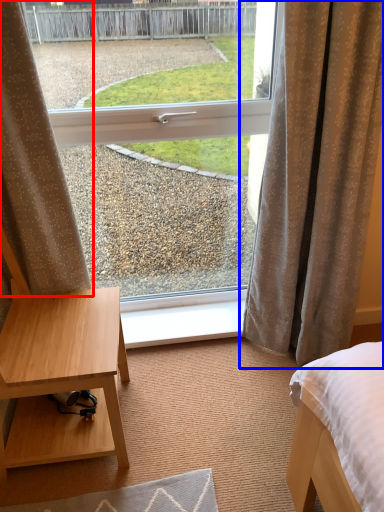
Question: Which object appears farthest to the camera in this image, curtain (highlighted by a red box) or curtain (highlighted by a blue box)?

Choices:
 (A) curtain
 (B) curtain

Answer: (B)